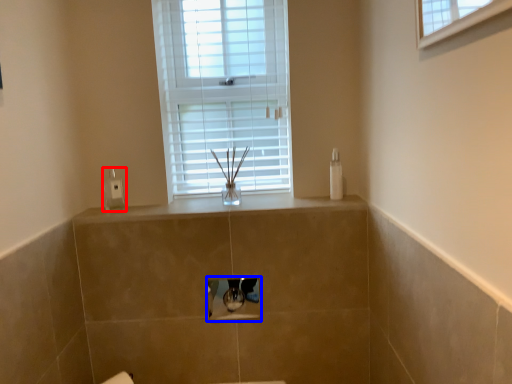
Question: Which point is further to the camera, soap dispenser (highlighted by a red box) or medicine cabinet (highlighted by a blue box)?

Choices:
 (A) soap dispenser
 (B) medicine cabinet

Answer: (A)